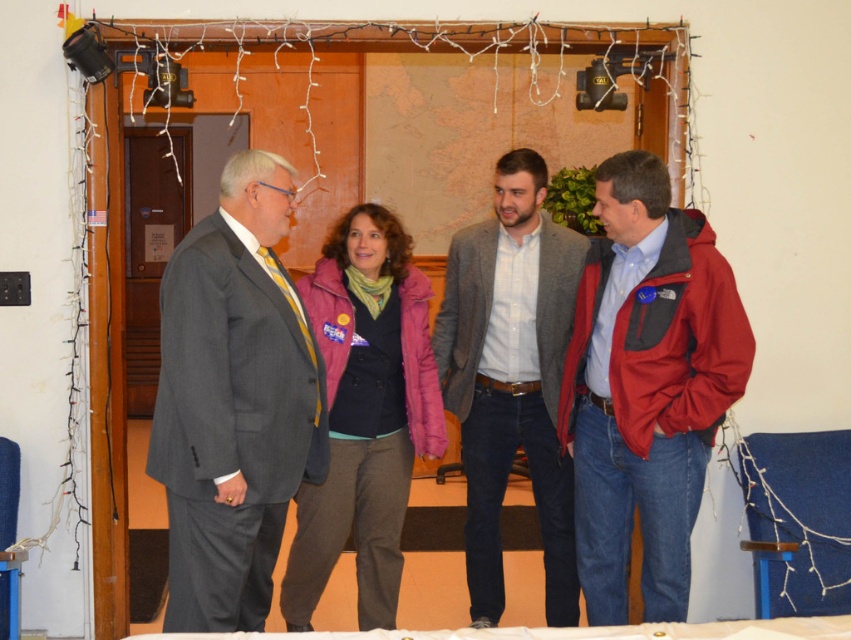
Does red softshell jacket at right have a larger size compared to pink fleece jacket at center?

Correct, red softshell jacket at right is larger in size than pink fleece jacket at center.

Which is above, red softshell jacket at right or pink fleece jacket at center?

red softshell jacket at right is higher up.

The height and width of the screenshot is (640, 851). Identify the location of red softshell jacket at right. (646, 387).

Describe the element at coordinates (646, 387) in the screenshot. I see `red softshell jacket at right` at that location.

Is red softshell jacket at right to the left of gray woolen blazer at center from the viewer's perspective?

No, red softshell jacket at right is not to the left of gray woolen blazer at center.

What do you see at coordinates (646, 387) in the screenshot?
I see `red softshell jacket at right` at bounding box center [646, 387].

Locate an element on the screen. red softshell jacket at right is located at coordinates (646, 387).

Does matte gray suit at left lie behind pink fleece jacket at center?

No.

Does matte gray suit at left have a greater height compared to pink fleece jacket at center?

No.

Where is `matte gray suit at left`? This screenshot has height=640, width=851. matte gray suit at left is located at coordinates (233, 401).

The image size is (851, 640). What are the coordinates of `matte gray suit at left` in the screenshot? It's located at (233, 401).